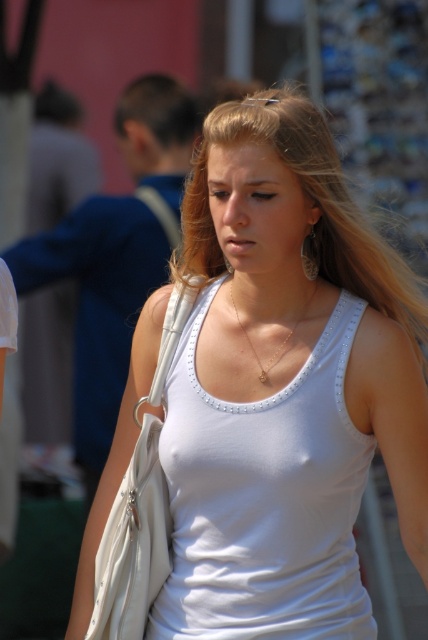
Is white fabric shoulder bag at center to the left of gold chain necklace at center from the viewer's perspective?

Correct, you'll find white fabric shoulder bag at center to the left of gold chain necklace at center.

Does white fabric shoulder bag at center lie behind gold chain necklace at center?

No, white fabric shoulder bag at center is closer to the viewer.

The height and width of the screenshot is (640, 428). What are the coordinates of `white fabric shoulder bag at center` in the screenshot? It's located at (139, 506).

How distant is white fabric tank top at center from dark brown hair at upper left?

8.94 feet

Which is above, white fabric tank top at center or dark brown hair at upper left?

dark brown hair at upper left

The width and height of the screenshot is (428, 640). What do you see at coordinates (285, 387) in the screenshot?
I see `white fabric tank top at center` at bounding box center [285, 387].

Where is `white fabric tank top at center`? The image size is (428, 640). white fabric tank top at center is located at coordinates (285, 387).

Does white fabric shoulder bag at center have a greater height compared to dark brown hair at upper left?

Indeed, white fabric shoulder bag at center has a greater height compared to dark brown hair at upper left.

Between white fabric shoulder bag at center and dark brown hair at upper left, which one has less height?

Standing shorter between the two is dark brown hair at upper left.

Which is behind, point (136, 620) or point (178, 132)?

The point (178, 132) is behind.

Where is `white fabric shoulder bag at center`? The image size is (428, 640). white fabric shoulder bag at center is located at coordinates (139, 506).